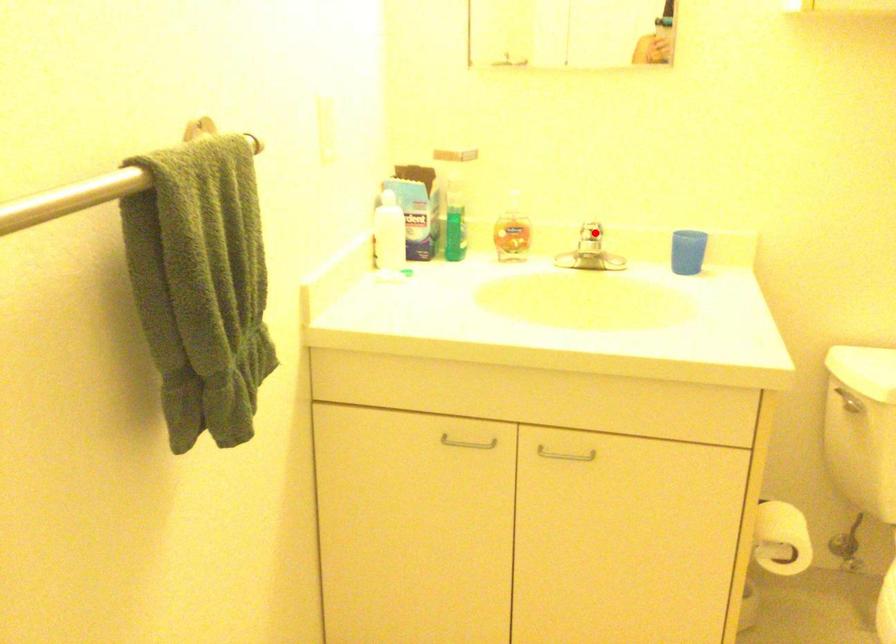
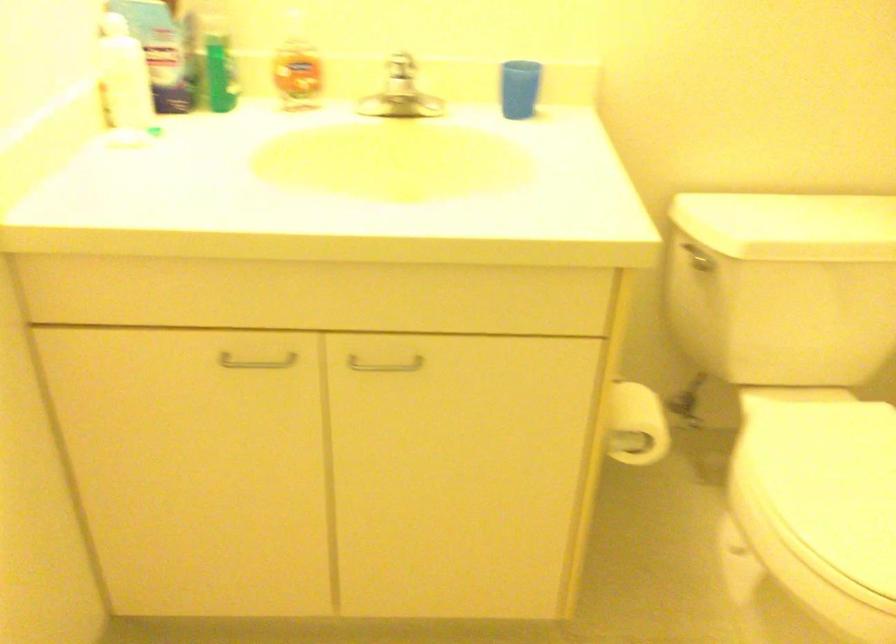
Question: I am providing you with two images of the same scene from different viewpoints. A red point is shown in image1. For the corresponding object point in image2, is it positioned nearer or farther from the camera?

Choices:
 (A) Nearer
 (B) Farther

Answer: (A)